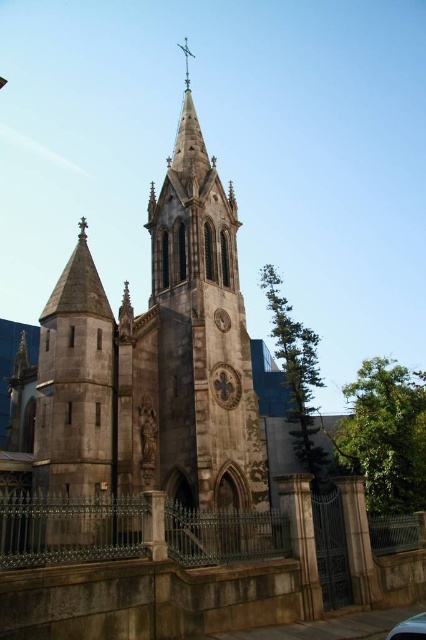
Question: Which of the following is the closest to the observer?

Choices:
 (A) metallic silver car at lower right
 (B) stone steeple at center

Answer: (A)

Question: Can you confirm if stone steeple at center is smaller than metallic silver car at lower right?

Choices:
 (A) no
 (B) yes

Answer: (A)

Question: Does stone steeple at center have a greater width compared to metallic silver car at lower right?

Choices:
 (A) no
 (B) yes

Answer: (B)

Question: Which object appears farthest from the camera in this image?

Choices:
 (A) metallic silver car at lower right
 (B) stone steeple at center

Answer: (B)

Question: Is stone steeple at center in front of metallic silver car at lower right?

Choices:
 (A) no
 (B) yes

Answer: (A)